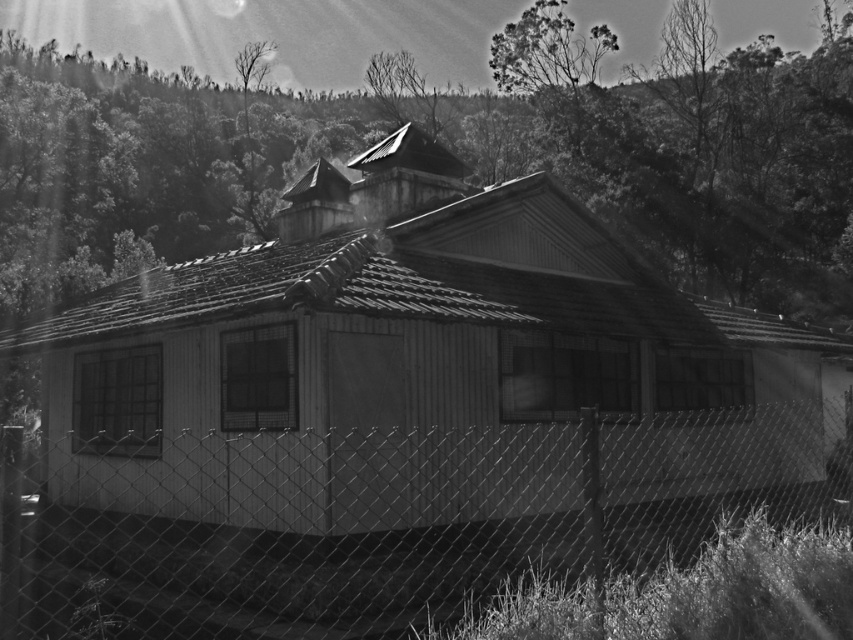
You are standing in front of the rustic house in the image. There is a point marked at coordinates (410,364). What object is located at this point?

The point at coordinates (410,364) indicates the wooden hut at center.

You are a photographer standing at the edge of the woods, looking at the wooden hut at center and the wire mesh fence at lower center. Which structure is higher in height?

The wooden hut at center is taller than the wire mesh fence at lower center.